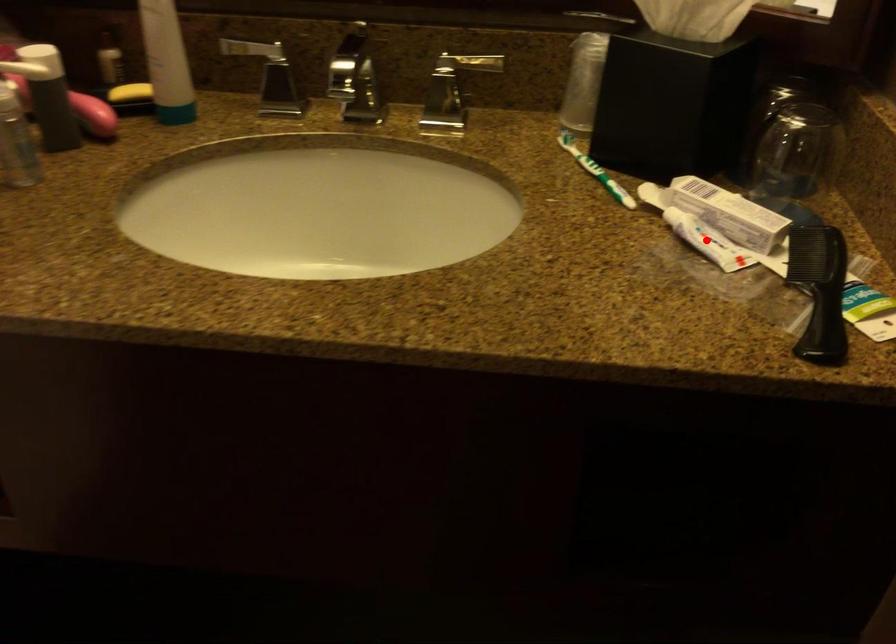
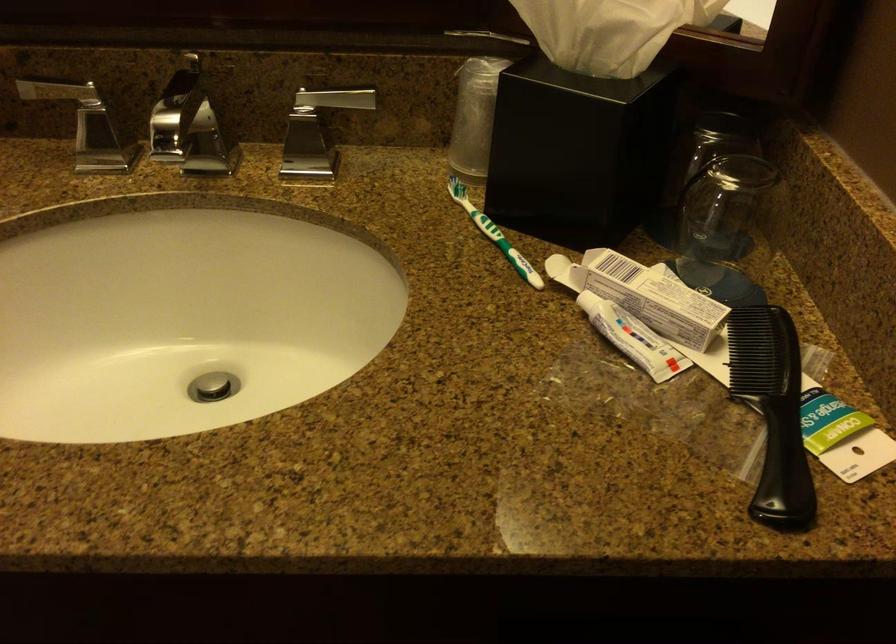
Question: I am providing you with two images of the same scene from different viewpoints. A red point is marked on the first image. Is the red point's position out of view in image 2?

Choices:
 (A) Yes
 (B) No

Answer: (B)